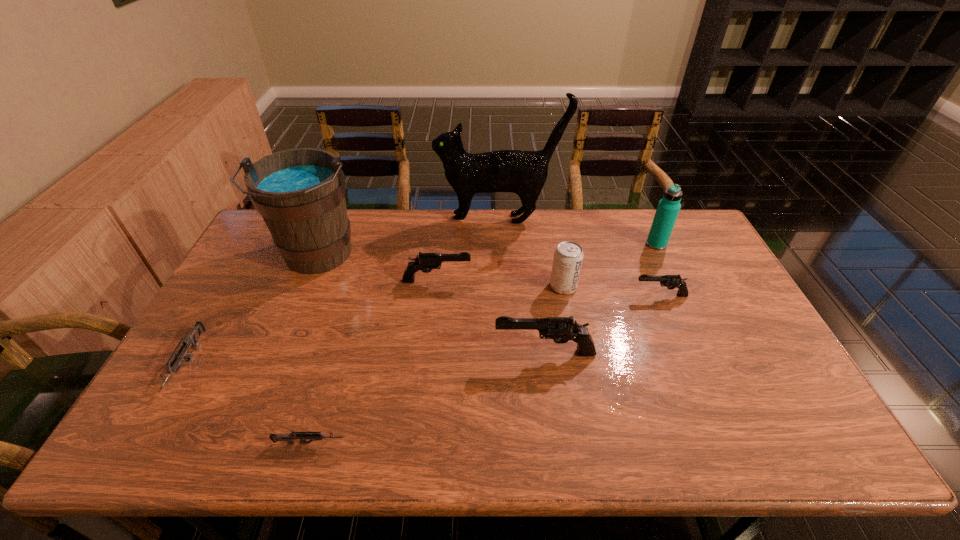
Locate an element on the screen. The height and width of the screenshot is (540, 960). free space located aimed along the barrel of the shortest object is located at coordinates (425, 443).

Image resolution: width=960 pixels, height=540 pixels. I want to click on cat that is at the far edge, so click(522, 172).

Locate an element on the screen. Image resolution: width=960 pixels, height=540 pixels. wine bucket that is at the far edge is located at coordinates (300, 193).

Identify the location of water bottle present at the far edge. coord(668,208).

Find the location of a particular element. The width and height of the screenshot is (960, 540). object present at the near edge is located at coordinates (314, 436).

The image size is (960, 540). I want to click on wine bucket positioned at the left edge, so click(x=300, y=193).

The image size is (960, 540). Find the location of `gun that is at the left edge`. gun that is at the left edge is located at coordinates (192, 340).

Locate an element on the screen. The image size is (960, 540). water bottle that is at the right edge is located at coordinates (668, 208).

This screenshot has width=960, height=540. What are the coordinates of `gun situated at the right edge` in the screenshot? It's located at (671, 282).

Locate an element on the screen. Image resolution: width=960 pixels, height=540 pixels. object present at the far left corner is located at coordinates (300, 193).